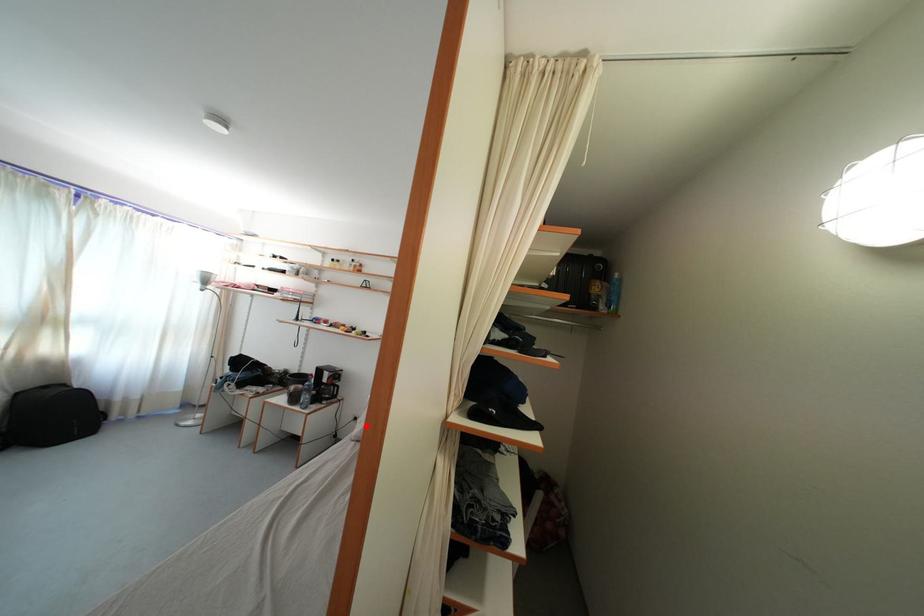
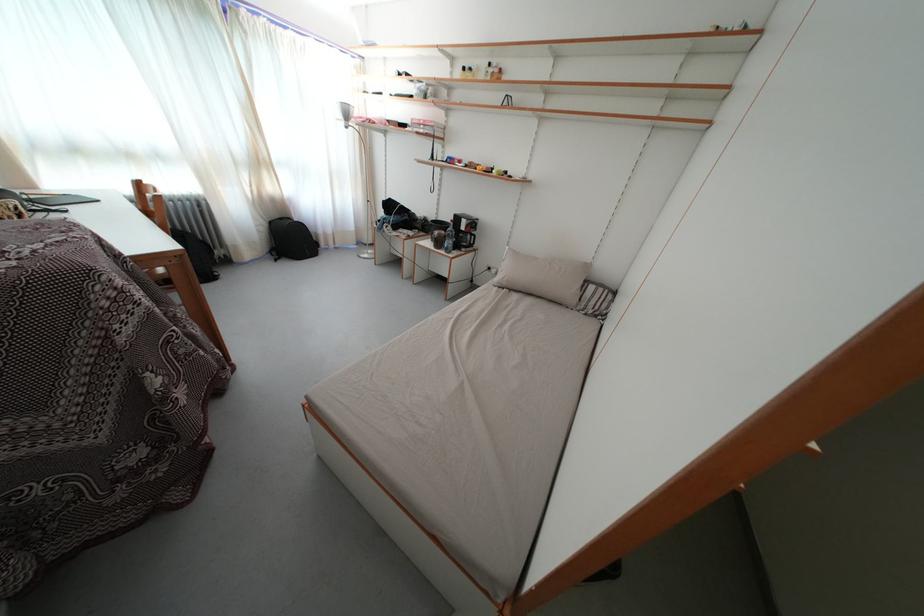
Question: I am providing you with two images of the same scene from different viewpoints. In image1, a red point is highlighted. Considering the same 3D point in image2, which of the following is correct?

Choices:
 (A) It is closer
 (B) It is farther

Answer: (B)